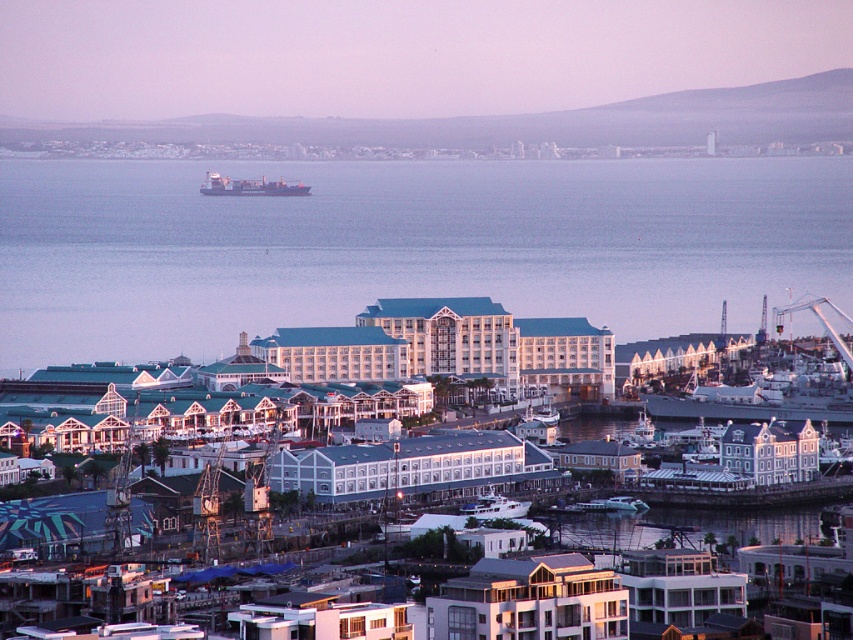
Is blue water at center behind white glossy building at center?

That is False.

Who is positioned more to the right, blue water at center or white glossy building at center?

From the viewer's perspective, white glossy building at center appears more on the right side.

Does point (578, 188) lie in front of point (605, 616)?

Yes, point (578, 188) is closer to viewer.

At what (x,y) coordinates should I click in order to perform the action: click on blue water at center. Please return your answer as a coordinate pair (x, y). Looking at the image, I should click on click(405, 246).

Does white glossy building at center appear on the right side of gray matte cargo ship at upper left?

Yes, white glossy building at center is to the right of gray matte cargo ship at upper left.

Where is `white glossy building at center`? This screenshot has width=853, height=640. white glossy building at center is located at coordinates (529, 600).

I want to click on white glossy building at center, so click(x=529, y=600).

Who is lower down, white glossy building at center or white glossy boat at center?

white glossy building at center is below.

Where is `white glossy building at center`? This screenshot has width=853, height=640. white glossy building at center is located at coordinates (529, 600).

You are a GUI agent. You are given a task and a screenshot of the screen. Output one action in this format:
    pyautogui.click(x=<x>, y=<y>)
    Task: Click on the white glossy building at center
    This screenshot has height=640, width=853.
    Given the screenshot: What is the action you would take?
    pyautogui.click(x=529, y=600)